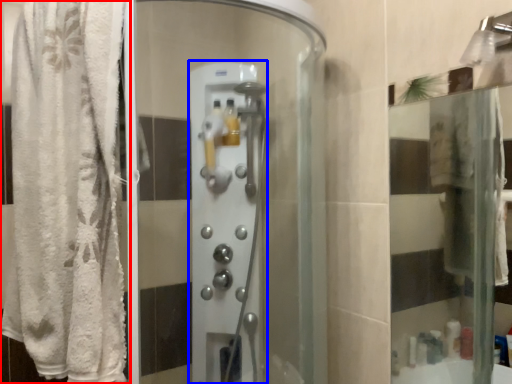
Question: Which object appears farthest to the camera in this image, curtain (highlighted by a red box) or screen door (highlighted by a blue box)?

Choices:
 (A) curtain
 (B) screen door

Answer: (B)